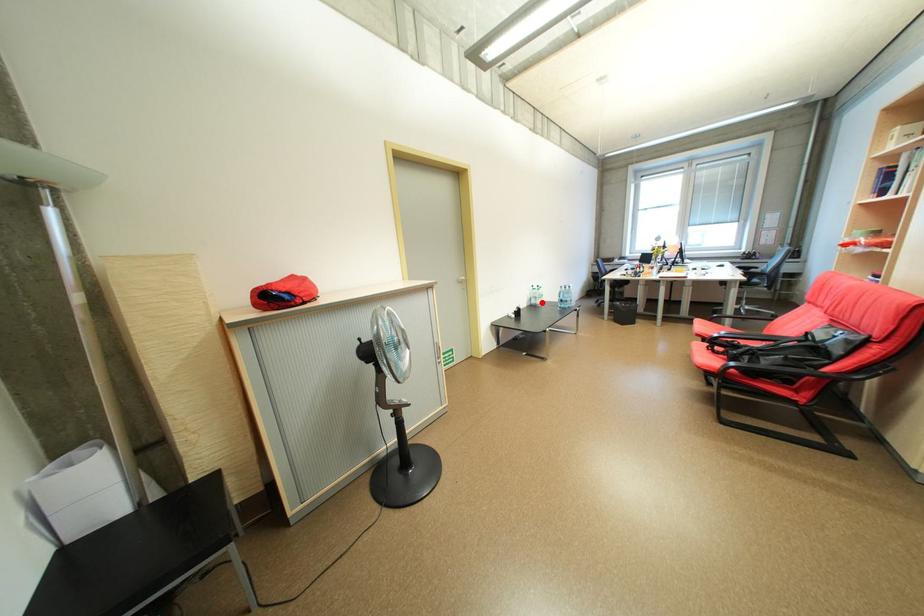
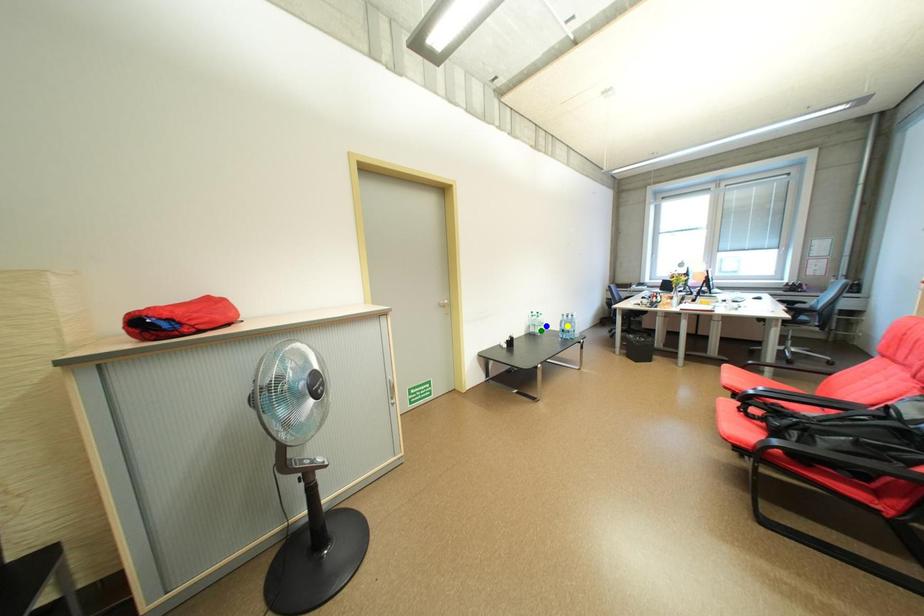
Question: I am providing you with two images of the same scene from different viewpoints. A red point is marked on the first image. You are given multiple points on the second image. In image 2, which mark is for the same physical point as the one in image 1?

Choices:
 (A) yellow point
 (B) green point
 (C) blue point

Answer: (B)